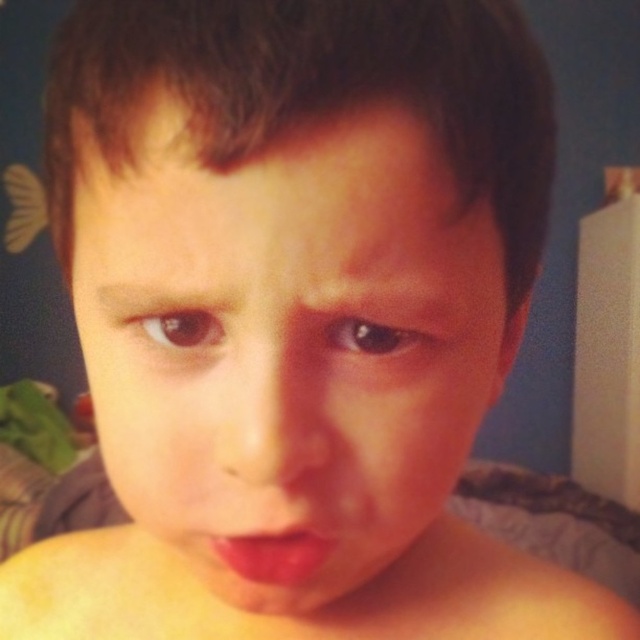
Question: Is smooth skin face at center smaller than matte pink lips at center?

Choices:
 (A) no
 (B) yes

Answer: (A)

Question: Can you confirm if smooth skin face at center is positioned below matte pink lips at center?

Choices:
 (A) no
 (B) yes

Answer: (A)

Question: Among these objects, which one is farthest from the camera?

Choices:
 (A) smooth skin face at center
 (B) matte pink lips at center

Answer: (B)

Question: Which object appears closest to the camera in this image?

Choices:
 (A) smooth skin face at center
 (B) matte pink lips at center

Answer: (A)

Question: Does smooth skin face at center have a greater width compared to matte pink lips at center?

Choices:
 (A) no
 (B) yes

Answer: (B)